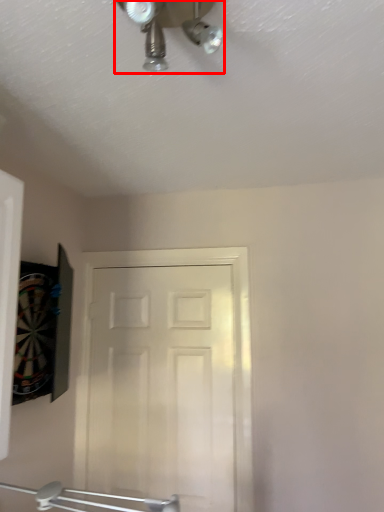
Question: From the image's perspective, where is mechanical fan (annotated by the red box) located relative to door?

Choices:
 (A) below
 (B) above

Answer: (B)